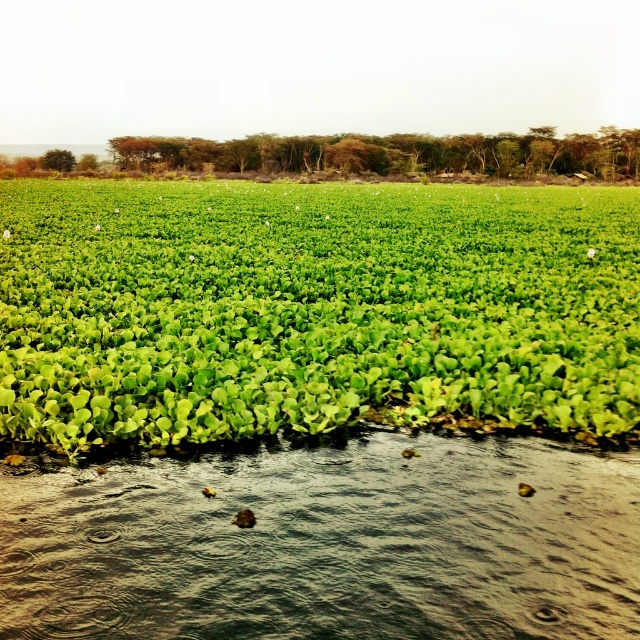
You are standing at the edge of the water and see two points in the scene. The first point is at coordinates point (316, 257) and the second is at point (68, 580). Which point is closer to you?

Point (68, 580) is closer to you because it is nearer than point (316, 257) which is further away.